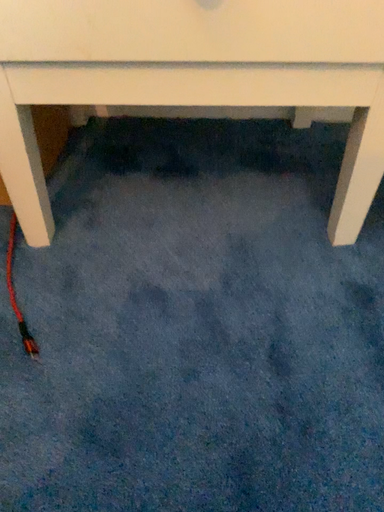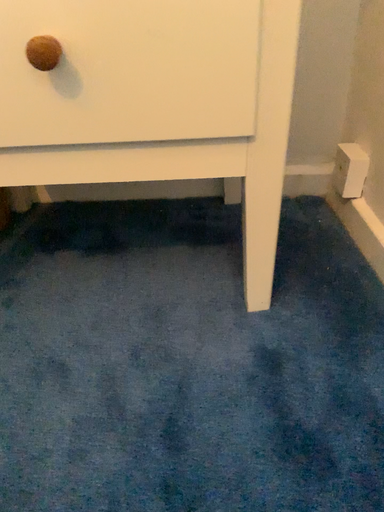
Question: How did the camera likely rotate when shooting the video?

Choices:
 (A) rotated upward
 (B) rotated downward

Answer: (A)